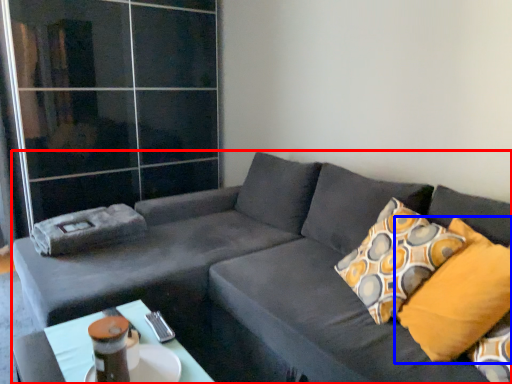
Question: Among these objects, which one is farthest to the camera, studio couch (highlighted by a red box) or pillow (highlighted by a blue box)?

Choices:
 (A) studio couch
 (B) pillow

Answer: (B)